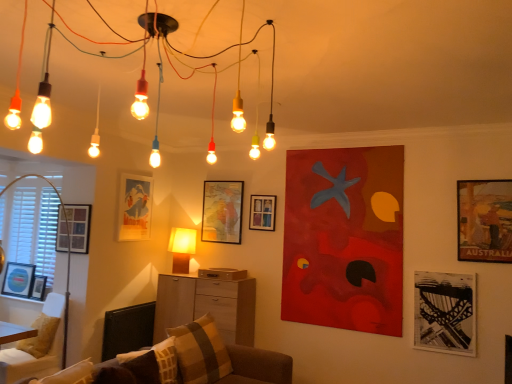
Question: Can you confirm if plush brown couch at lower center is smaller than matte paper picture frame at upper left, which is the fourth picture frame in left-to-right order?

Choices:
 (A) no
 (B) yes

Answer: (A)

Question: From a real-world perspective, is plush brown couch at lower center physically below matte paper picture frame at upper left, which is counted as the fifth picture frame, starting from the right?

Choices:
 (A) no
 (B) yes

Answer: (B)

Question: Considering the relative sizes of plush brown couch at lower center and matte paper picture frame at upper left, which is counted as the fifth picture frame, starting from the right, in the image provided, is plush brown couch at lower center shorter than matte paper picture frame at upper left, which is counted as the fifth picture frame, starting from the right,?

Choices:
 (A) no
 (B) yes

Answer: (B)

Question: Is plush brown couch at lower center facing away from matte paper picture frame at upper left, which is the fourth picture frame in left-to-right order?

Choices:
 (A) no
 (B) yes

Answer: (A)

Question: Could matte paper picture frame at upper left, which is the fourth picture frame in left-to-right order, be considered to be inside plush brown couch at lower center?

Choices:
 (A) no
 (B) yes

Answer: (A)

Question: Does point (245, 302) appear closer or farther from the camera than point (44, 284)?

Choices:
 (A) closer
 (B) farther

Answer: (A)

Question: Is wooden cabinet at center in front of or behind matte black picture frame at left, which appears as the second picture frame when viewed from the left, in the image?

Choices:
 (A) behind
 (B) front

Answer: (B)

Question: Looking at their shapes, would you say wooden cabinet at center is wider or thinner than matte black picture frame at left, the 7th picture frame positioned from the right?

Choices:
 (A) thin
 (B) wide

Answer: (B)

Question: From the image's perspective, is wooden cabinet at center positioned above or below matte black picture frame at left, which appears as the second picture frame when viewed from the left?

Choices:
 (A) below
 (B) above

Answer: (A)

Question: Is matte blue picture frame at left, the 8th picture frame positioned from the right, taller or shorter than matte yellow plastic lamp at center?

Choices:
 (A) short
 (B) tall

Answer: (A)

Question: From the image's perspective, is matte blue picture frame at left, the first picture frame when ordered from left to right, positioned above or below matte yellow plastic lamp at center?

Choices:
 (A) above
 (B) below

Answer: (B)

Question: Considering the positions of matte blue picture frame at left, the 8th picture frame positioned from the right, and matte yellow plastic lamp at center in the image, is matte blue picture frame at left, the 8th picture frame positioned from the right, bigger or smaller than matte yellow plastic lamp at center?

Choices:
 (A) small
 (B) big

Answer: (A)

Question: Is matte blue picture frame at left, the 8th picture frame positioned from the right, wider or thinner than matte yellow plastic lamp at center?

Choices:
 (A) thin
 (B) wide

Answer: (A)

Question: Is matte paper picture frame at upper left, which is the fourth picture frame in left-to-right order, inside the boundaries of wooden cabinet at center, or outside?

Choices:
 (A) inside
 (B) outside

Answer: (B)

Question: Looking at their shapes, would you say matte paper picture frame at upper left, which is the fourth picture frame in left-to-right order, is wider or thinner than wooden cabinet at center?

Choices:
 (A) thin
 (B) wide

Answer: (A)